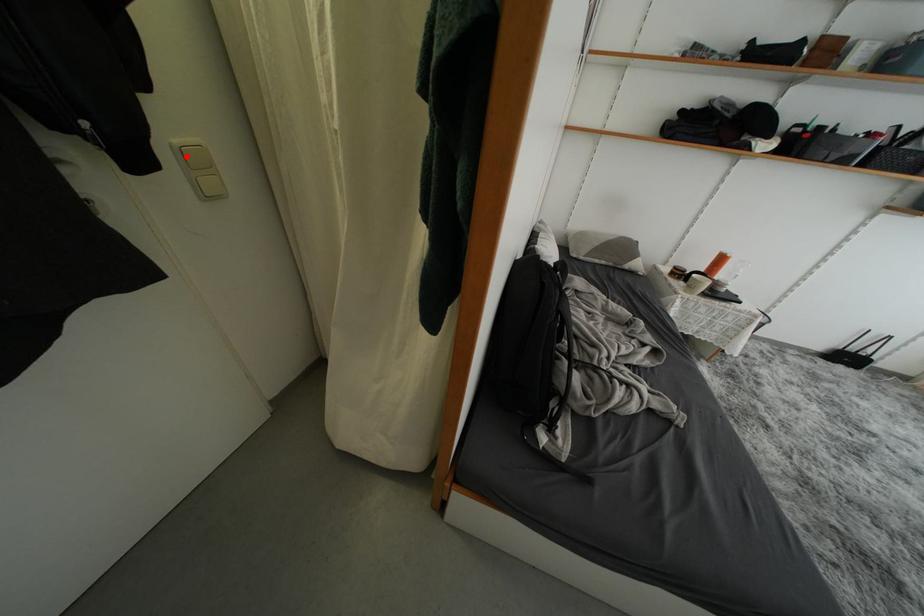
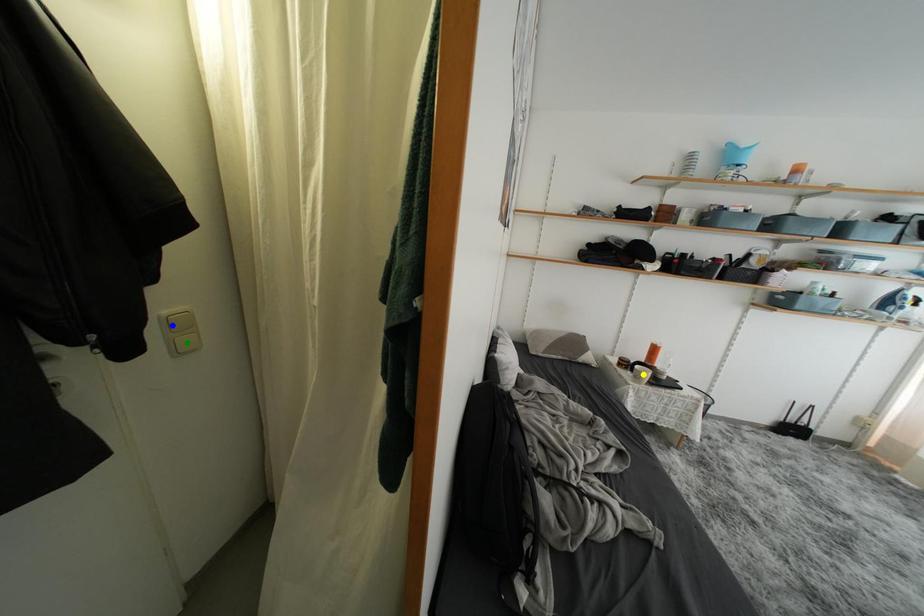
Question: I am providing you with two images of the same scene from different viewpoints. A red point is marked on the first image. You are given multiple points on the second image. Which mark in image 2 goes with the point in image 1?

Choices:
 (A) yellow point
 (B) blue point
 (C) green point

Answer: (B)